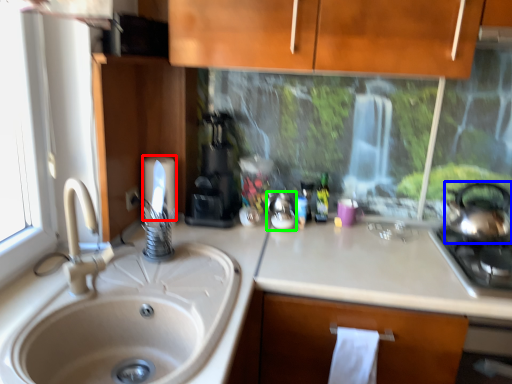
Question: Based on their relative distances, which object is nearer to toilet paper (highlighted by a red box)? Choose from tea pot (highlighted by a blue box) and appliance (highlighted by a green box).

Choices:
 (A) tea pot
 (B) appliance

Answer: (B)